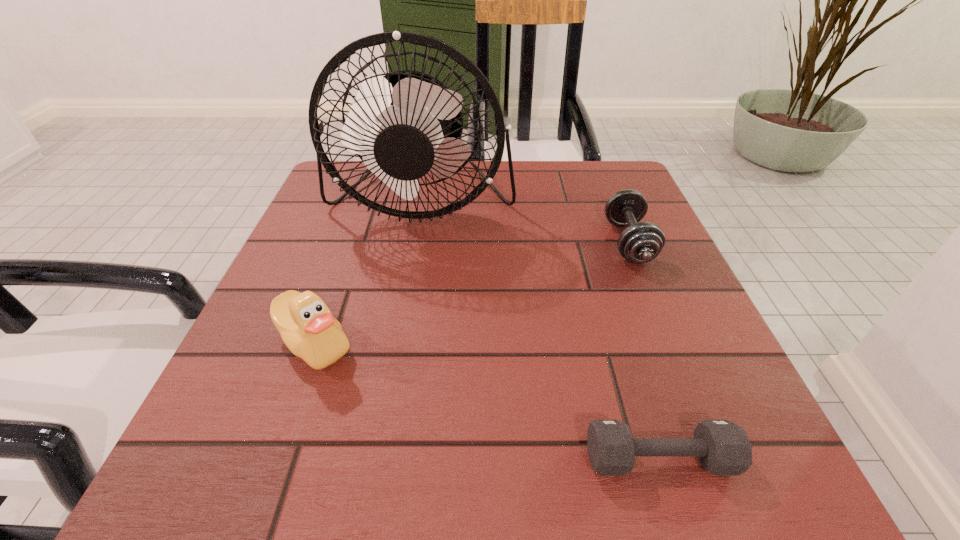
You are a GUI agent. You are given a task and a screenshot of the screen. Output one action in this format:
    pyautogui.click(x=<x>, y=<y>)
    Task: Click on the vacant space located on the left of the nearest object
    The width and height of the screenshot is (960, 540).
    Given the screenshot: What is the action you would take?
    pyautogui.click(x=332, y=458)

Find the location of a particular element. Image resolution: width=960 pixels, height=540 pixels. object at the far edge is located at coordinates (404, 125).

The image size is (960, 540). Identify the location of object that is at the near edge. (722, 447).

This screenshot has width=960, height=540. I want to click on fan located in the left edge section of the desktop, so click(x=404, y=125).

Find the location of a particular element. This screenshot has height=540, width=960. duck that is at the left edge is located at coordinates (307, 327).

Where is `object that is at the far left corner`? The image size is (960, 540). object that is at the far left corner is located at coordinates (404, 125).

Where is `object located at the near right corner`? The height and width of the screenshot is (540, 960). object located at the near right corner is located at coordinates (722, 447).

This screenshot has width=960, height=540. Find the location of `vacant area at the far edge of the desktop`. vacant area at the far edge of the desktop is located at coordinates (421, 180).

The image size is (960, 540). In the image, there is a desktop. Identify the location of vacant space at the near edge. (636, 480).

Locate an element on the screen. free space at the left edge is located at coordinates (366, 231).